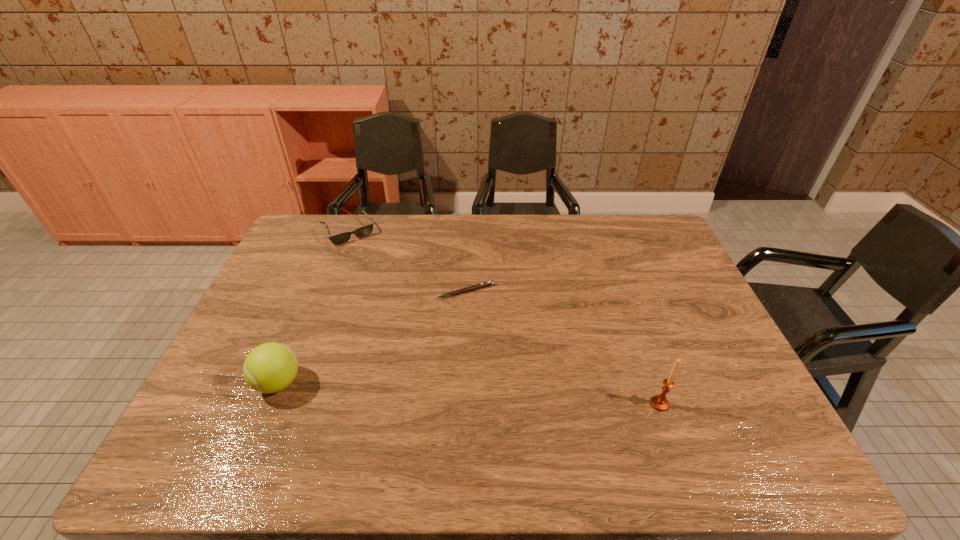
Identify the location of free spot on the desktop that is between the tennis ball and the candle_holder and is positioned at the nib of the second farthest object. (435, 392).

Locate an element on the screen. The image size is (960, 540). free spot on the desktop that is between the tennis ball and the tallest object and is positioned on the front-facing side of the sunglasses is located at coordinates (458, 393).